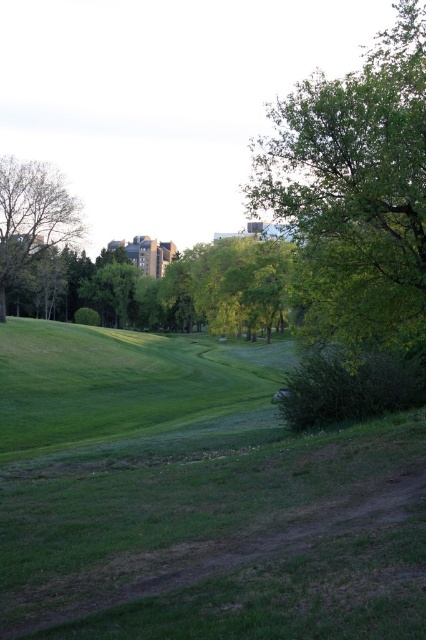
You are standing at the point with coordinates point (x=385, y=180) and want to walk to point (x=22, y=262). Based on the scene, will you have to walk uphill or downhill?

Point (x=385, y=180) is closer to the viewer than point (x=22, y=262). Since the foreground has a gently sloping grassy area with a dirt path, walking from a closer point to a farther one typically means moving towards lower ground. Therefore, you will have to walk downhill.

You are standing on the dirt path in the park and want to know which tree is taller between the green leafy tree at upper right and the green leafy tree at left. Based on the scene, can you determine which one is taller?

The green leafy tree at upper right is taller than the green leafy tree at left.